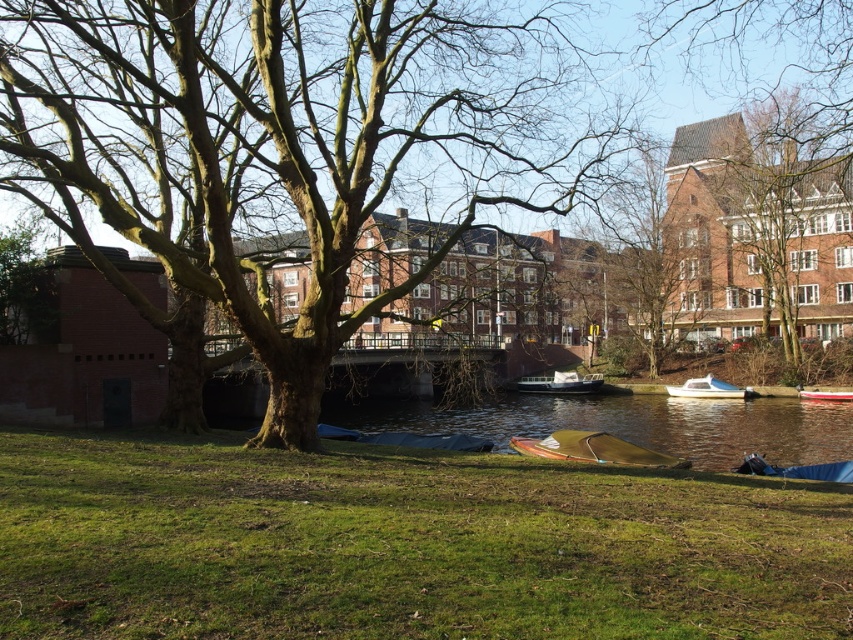
You are standing in the riverside scene and want to take a photo of the brown rough tree at upper center and the red plastic boat at lower right. Which object will appear larger in your photo?

The brown rough tree at upper center will appear larger in the photo because it is closer to the viewer than the red plastic boat at lower right.

From the picture: You are standing at the point labeled as point (782,218) in the image. What object is directly in front of you?

The point (782,218) indicates the brown rough tree at upper center, so the object directly in front of you is the brown rough tree at upper center.

You are standing at the center of the image and want to walk towards the green grass at lower center. Which direction should you move relative to your current position?

Since the green grass at lower center is located at point 0.852 on the x axis and 0.474 on the y axis, you should move towards the lower right direction to reach it.